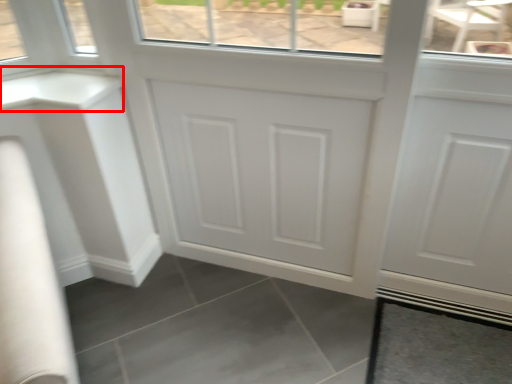
Question: From the image's perspective, where is counter top (annotated by the red box) located relative to tile?

Choices:
 (A) below
 (B) above

Answer: (B)